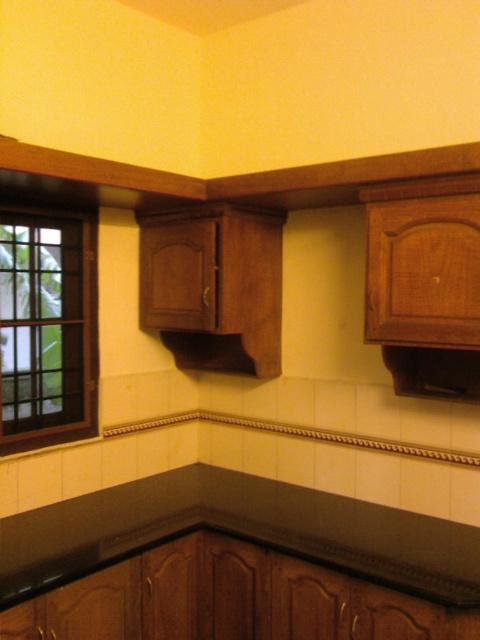
Is black laminate counter top at upper center wider than brown wooden window at left?

Yes, black laminate counter top at upper center is wider than brown wooden window at left.

Is black laminate counter top at upper center behind brown wooden window at left?

No.

This screenshot has width=480, height=640. Identify the location of black laminate counter top at upper center. (233, 566).

You are a GUI agent. You are given a task and a screenshot of the screen. Output one action in this format:
    pyautogui.click(x=<x>, y=<y>)
    Task: Click on the black laminate counter top at upper center
    
    Given the screenshot: What is the action you would take?
    pyautogui.click(x=233, y=566)